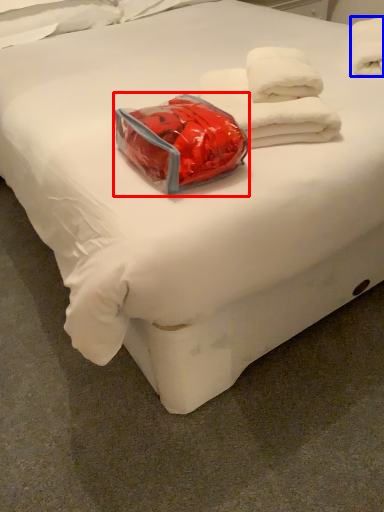
Question: Which object appears closest to the camera in this image, package (highlighted by a red box) or towel (highlighted by a blue box)?

Choices:
 (A) package
 (B) towel

Answer: (A)